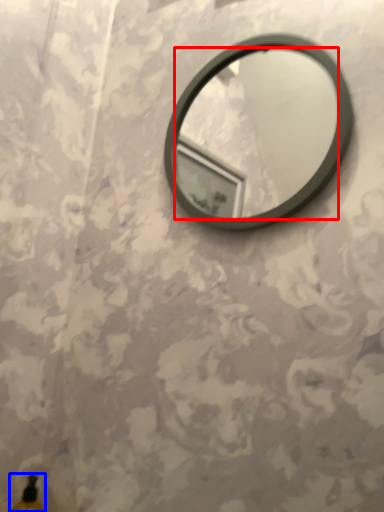
Question: Which object is closer to the camera taking this photo, mirror (highlighted by a red box) or bottle (highlighted by a blue box)?

Choices:
 (A) mirror
 (B) bottle

Answer: (A)